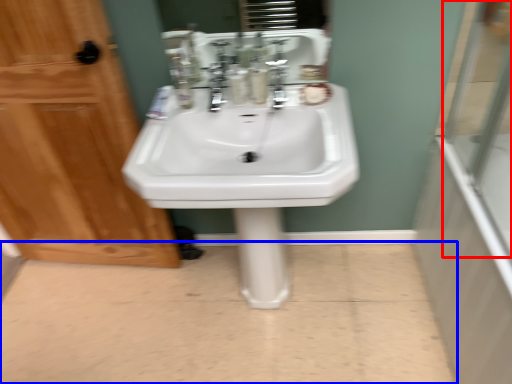
Question: Among these objects, which one is nearest to the camera, glass door (highlighted by a red box) or plain (highlighted by a blue box)?

Choices:
 (A) glass door
 (B) plain

Answer: (A)